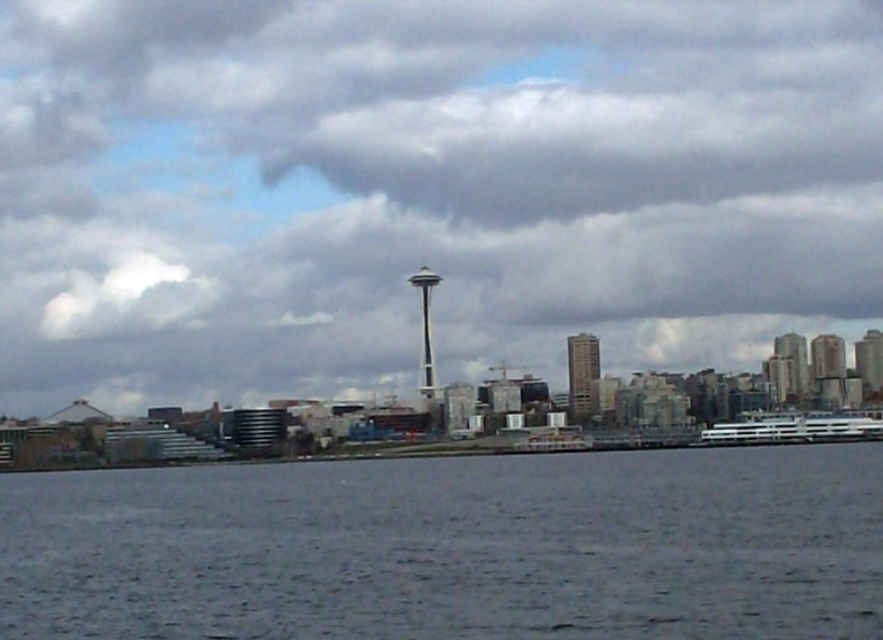
Who is more forward, (300, 28) or (872, 413)?

Positioned in front is point (300, 28).

Who is more distant from viewer, (164, 100) or (809, 413)?

Positioned behind is point (164, 100).

Does point (610, 74) come behind point (864, 436)?

No, it is in front of (864, 436).

Identify the location of cloudy sky at center. (425, 189).

Which is behind, point (619, 20) or point (1, 499)?

Point (1, 499)

Which is above, cloudy sky at center or gray matte water at lower center?

Positioned higher is cloudy sky at center.

Between point (509, 200) and point (165, 492), which one is positioned in front?

Point (509, 200) is in front.

In order to click on cloudy sky at center in this screenshot , I will do `click(425, 189)`.

Is gray matte water at lower center closer to camera compared to white glossy ferry at right?

Yes, gray matte water at lower center is in front of white glossy ferry at right.

From the picture: Can you confirm if gray matte water at lower center is positioned to the left of white glossy ferry at right?

Yes, gray matte water at lower center is to the left of white glossy ferry at right.

Does point (479, 588) come in front of point (872, 417)?

Yes, it is in front of point (872, 417).

Locate an element on the screen. The width and height of the screenshot is (883, 640). gray matte water at lower center is located at coordinates (453, 547).